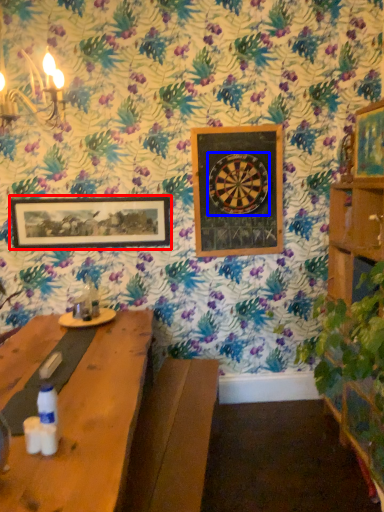
Question: Which object is further to the camera taking this photo, picture frame (highlighted by a red box) or design (highlighted by a blue box)?

Choices:
 (A) picture frame
 (B) design

Answer: (A)